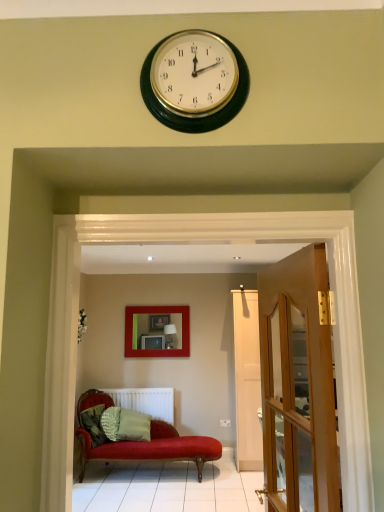
Question: Is white matte radiator at lower center bigger than green textured pillow at lower left, the 1th pillow in the left-to-right sequence?

Choices:
 (A) yes
 (B) no

Answer: (A)

Question: From the image's perspective, is white matte radiator at lower center under green textured pillow at lower left, which is the second pillow in right-to-left order?

Choices:
 (A) no
 (B) yes

Answer: (B)

Question: From a real-world perspective, does white matte radiator at lower center sit lower than green textured pillow at lower left, the 1th pillow in the left-to-right sequence?

Choices:
 (A) yes
 (B) no

Answer: (A)

Question: Considering the relative sizes of white matte radiator at lower center and green textured pillow at lower left, which is the second pillow in right-to-left order, in the image provided, is white matte radiator at lower center smaller than green textured pillow at lower left, which is the second pillow in right-to-left order,?

Choices:
 (A) yes
 (B) no

Answer: (B)

Question: Does white matte radiator at lower center have a greater width compared to green textured pillow at lower left, the 1th pillow in the left-to-right sequence?

Choices:
 (A) no
 (B) yes

Answer: (A)

Question: Is white matte radiator at lower center to the right of green textured pillow at lower left, the 1th pillow in the left-to-right sequence, from the viewer's perspective?

Choices:
 (A) yes
 (B) no

Answer: (A)

Question: Can you confirm if wooden glass door at right is bigger than white matte radiator at lower center?

Choices:
 (A) no
 (B) yes

Answer: (A)

Question: Are wooden glass door at right and white matte radiator at lower center far apart?

Choices:
 (A) no
 (B) yes

Answer: (B)

Question: Does wooden glass door at right lie in front of white matte radiator at lower center?

Choices:
 (A) yes
 (B) no

Answer: (A)

Question: Are wooden glass door at right and white matte radiator at lower center making contact?

Choices:
 (A) no
 (B) yes

Answer: (A)

Question: From the image's perspective, does wooden glass door at right appear lower than white matte radiator at lower center?

Choices:
 (A) no
 (B) yes

Answer: (A)

Question: Considering the relative sizes of wooden glass door at right and white matte radiator at lower center in the image provided, is wooden glass door at right wider than white matte radiator at lower center?

Choices:
 (A) yes
 (B) no

Answer: (B)

Question: Is green textured pillow at lower left, the 1th pillow in the left-to-right sequence, smaller than matte red picture frame at center?

Choices:
 (A) yes
 (B) no

Answer: (A)